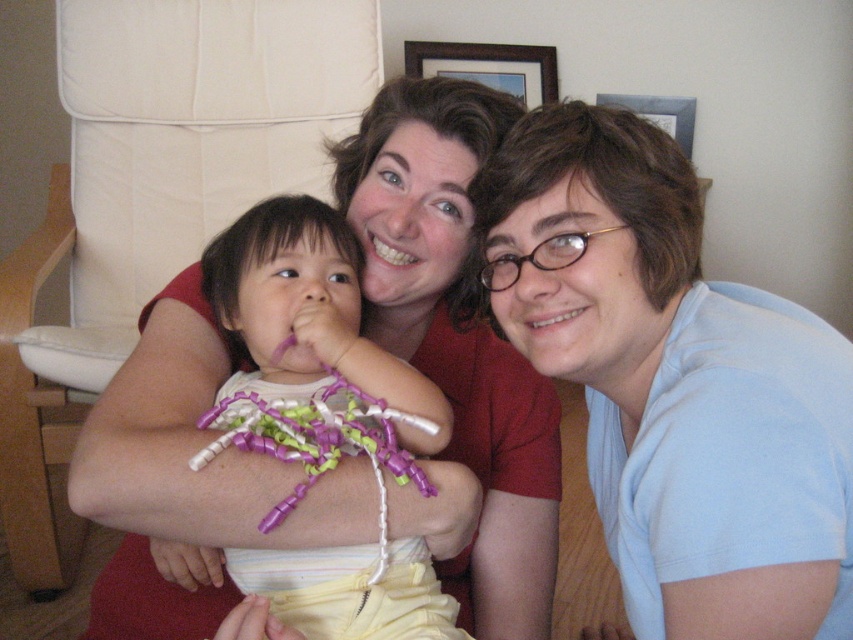
You are an interior designer planning to place a new sofa in the living room. You see the white fabric armchair at upper left and the purple plastic toy at center. Which object has a greater width?

The white fabric armchair at upper left has a greater width than the purple plastic toy at center.

You are planning to place a small table next to the white fabric armchair at upper left. Based on its position, where would you place the table to ensure it is adjacent to the chair?

The white fabric armchair at upper left is located at point (184, 144), so the table should be placed near those coordinates to be adjacent to the chair.